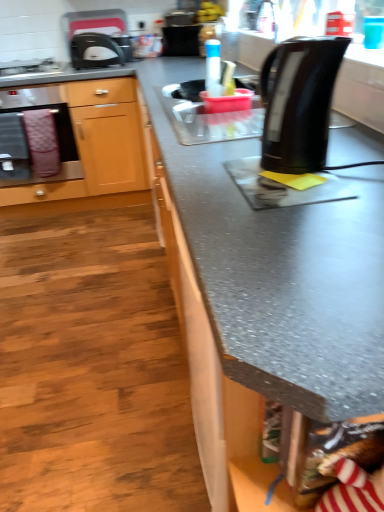
Question: In the image, is stainless steel oven at left positioned in front of or behind transparent plastic bottle at center?

Choices:
 (A) front
 (B) behind

Answer: (B)

Question: In terms of width, does stainless steel oven at left look wider or thinner when compared to transparent plastic bottle at center?

Choices:
 (A) wide
 (B) thin

Answer: (A)

Question: Which is farther from the black glossy electric kettle at right?

Choices:
 (A) matte black toaster at upper left
 (B) white glossy gas stove at upper left
 (C) transparent plastic bottle at center
 (D) pink fabric towel at left
 (E) wooden cabinet at left

Answer: (B)

Question: Which of these objects is positioned farthest from the white glossy gas stove at upper left?

Choices:
 (A) matte black toaster at upper left
 (B) pink fabric towel at left
 (C) black glossy electric kettle at right
 (D) wooden cabinet at left
 (E) black plastic toaster at upper left

Answer: (C)